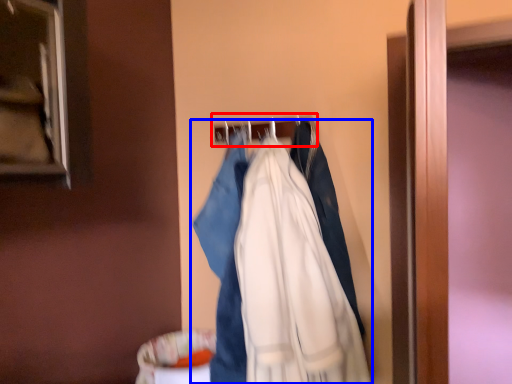
Question: Which object is closer to the camera taking this photo, hanger (highlighted by a red box) or fancy dress (highlighted by a blue box)?

Choices:
 (A) hanger
 (B) fancy dress

Answer: (B)